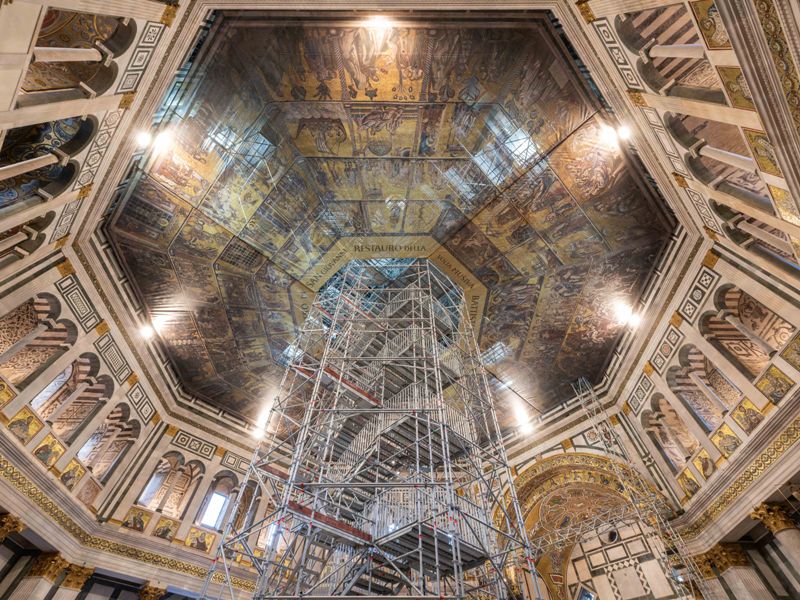
You are a GUI agent. You are given a task and a screenshot of the screen. Output one action in this format:
    pyautogui.click(x=<x>, y=<y>)
    Task: Click on the light
    The height and width of the screenshot is (600, 800).
    Given the screenshot: What is the action you would take?
    pyautogui.click(x=142, y=141), pyautogui.click(x=380, y=20), pyautogui.click(x=617, y=132), pyautogui.click(x=628, y=320), pyautogui.click(x=522, y=428), pyautogui.click(x=256, y=431), pyautogui.click(x=149, y=335)